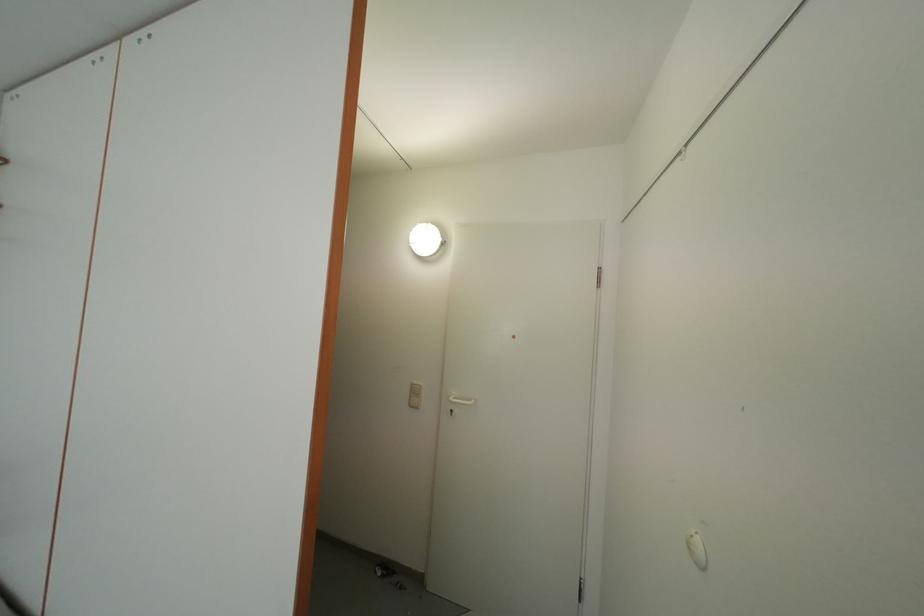
Identify the location of door keyhole. The width and height of the screenshot is (924, 616). (697, 549).